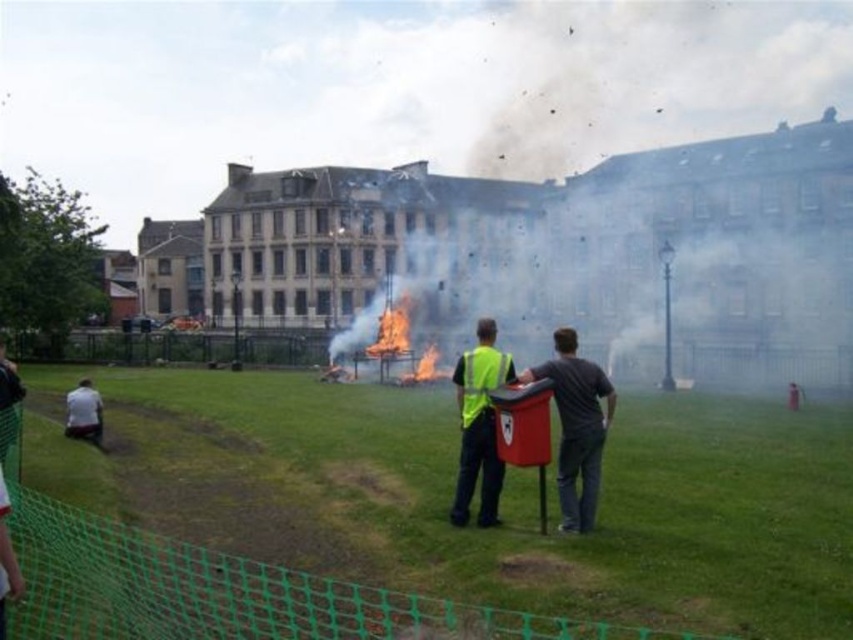
You are a park ranger observing the controlled fire scene. You notice a person at the coordinates point (576, 426). What is the clothing color of that individual?

The individual at point (576, 426) is wearing a dark gray fabric shirt at center.

You are a firefighter observing the scene. You notice the white smoke at center and the yellow reflective vest at center. From your vantage point, which object is located to the right of the other?

A: The white smoke at center is positioned on the right side of yellow reflective vest at center, so the white smoke at center is to the right of the yellow reflective vest at center.

From the picture: You are a firefighter observing the controlled fire in the park. You notice the white smoke at center. Based on its position, can you determine if it is coming from the fire directly below it or from another source?

The white smoke at center is located at point (695, 198), which corresponds to the area directly above the fire contained within the metal frame. Therefore, the smoke is coming from the fire itself.